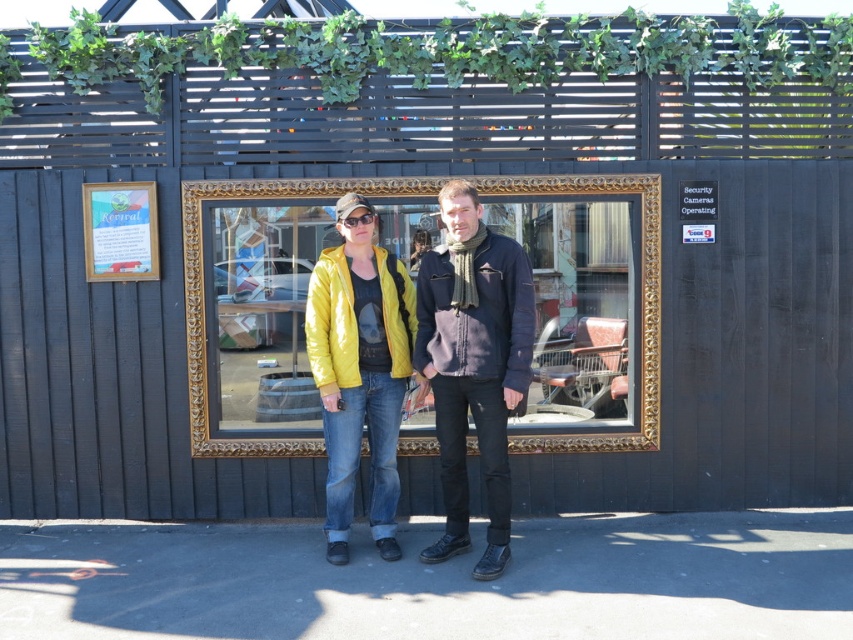
Question: Based on their relative distances, which object is farther from the wooden sign at upper left?

Choices:
 (A) gold/gilded picture frame at center
 (B) dark blue fleece jacket at center
 (C) yellow matte jacket at center

Answer: (B)

Question: Considering the relative positions of matte yellow jacket at center and dark blue fleece jacket at center in the image provided, where is matte yellow jacket at center located with respect to dark blue fleece jacket at center?

Choices:
 (A) left
 (B) right

Answer: (A)

Question: Does dark blue fleece jacket at center lie in front of wooden sign at upper left?

Choices:
 (A) yes
 (B) no

Answer: (A)

Question: Which object is closer to the camera taking this photo?

Choices:
 (A) yellow matte jacket at center
 (B) dark blue fleece jacket at center
 (C) gold/gilded picture frame at center

Answer: (A)

Question: Does gold/gilded picture frame at center have a larger size compared to dark blue fleece jacket at center?

Choices:
 (A) yes
 (B) no

Answer: (A)

Question: Which point is farther to the camera?

Choices:
 (A) (503, 298)
 (B) (450, 195)
 (C) (312, 285)

Answer: (C)